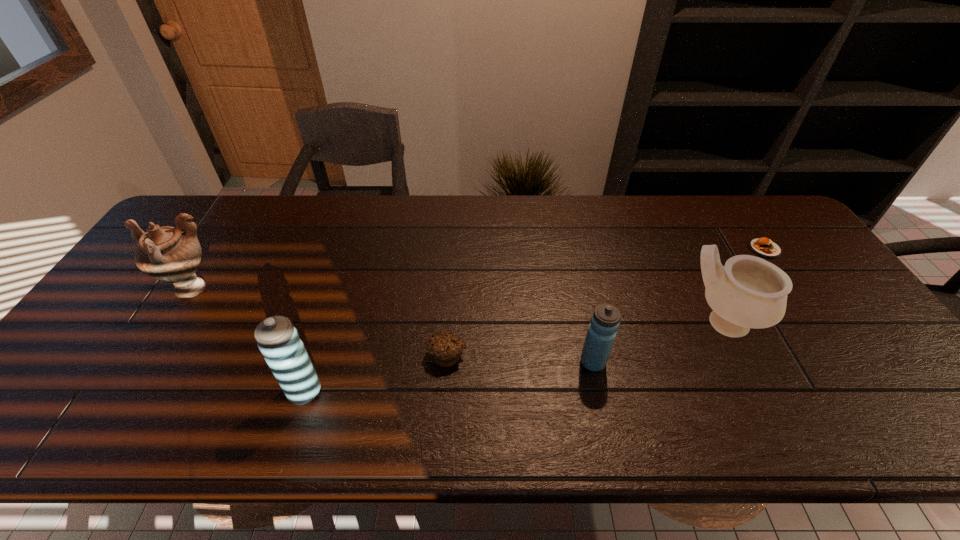
Where is `free space between the pottery and the nearer water bottle`? This screenshot has width=960, height=540. free space between the pottery and the nearer water bottle is located at coordinates (514, 357).

Where is `free space between the patty (food) and the leftmost object`? The height and width of the screenshot is (540, 960). free space between the patty (food) and the leftmost object is located at coordinates (477, 269).

Find the location of a particular element. Image resolution: width=960 pixels, height=540 pixels. vacant space that's between the patty (food) and the fourth object from right to left is located at coordinates (606, 302).

At what (x,y) coordinates should I click in order to perform the action: click on free space between the patty (food) and the leftmost object. Please return your answer as a coordinate pair (x, y). The width and height of the screenshot is (960, 540). Looking at the image, I should click on (477, 269).

This screenshot has width=960, height=540. I want to click on free space between the leftmost object and the right water bottle, so click(391, 326).

Where is `vacant space that's between the nearest object and the urn`? The image size is (960, 540). vacant space that's between the nearest object and the urn is located at coordinates (247, 340).

What are the coordinates of `vacant space in between the third object from left to right and the shortest object` in the screenshot? It's located at (606, 302).

Locate which object is the second closest to the urn. Please provide its 2D coordinates. Your answer should be formatted as a tuple, i.e. [(x, y)], where the tuple contains the x and y coordinates of a point satisfying the conditions above.

[(445, 347)]

Find the location of a particular element. The height and width of the screenshot is (540, 960). the third closest object relative to the farther water bottle is located at coordinates (278, 340).

Locate an element on the screen. This screenshot has height=540, width=960. free spot that satisfies the following two spatial constraints: 1. on the back side of the fifth object from left to right; 2. on the left side of the fourth object from left to right is located at coordinates (585, 322).